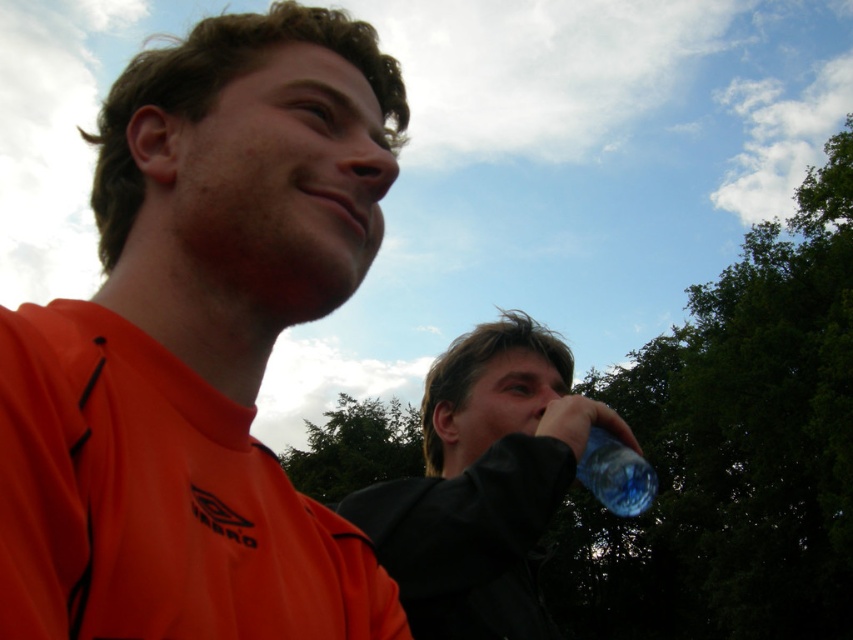
Can you confirm if orange matte shirt at upper left is bigger than transparent plastic bottle at center?

Actually, orange matte shirt at upper left might be smaller than transparent plastic bottle at center.

Which is behind, point (306, 506) or point (514, 372)?

The point (514, 372) is more distant.

Where is `orange matte shirt at upper left`? orange matte shirt at upper left is located at coordinates (199, 348).

Is transparent plastic bottle at center closer to the viewer compared to transparent plastic bottle at right?

Yes, transparent plastic bottle at center is in front of transparent plastic bottle at right.

Which is more to the left, transparent plastic bottle at center or transparent plastic bottle at right?

transparent plastic bottle at center

You are a GUI agent. You are given a task and a screenshot of the screen. Output one action in this format:
    pyautogui.click(x=<x>, y=<y>)
    Task: Click on the transparent plastic bottle at center
    The height and width of the screenshot is (640, 853).
    Given the screenshot: What is the action you would take?
    pyautogui.click(x=483, y=483)

Image resolution: width=853 pixels, height=640 pixels. Find the location of `transparent plastic bottle at center`. transparent plastic bottle at center is located at coordinates (483, 483).

Is orange matte shirt at upper left further to the viewer compared to transparent plastic bottle at right?

No, it is in front of transparent plastic bottle at right.

Is orange matte shirt at upper left wider than transparent plastic bottle at right?

Indeed, orange matte shirt at upper left has a greater width compared to transparent plastic bottle at right.

This screenshot has height=640, width=853. I want to click on orange matte shirt at upper left, so click(x=199, y=348).